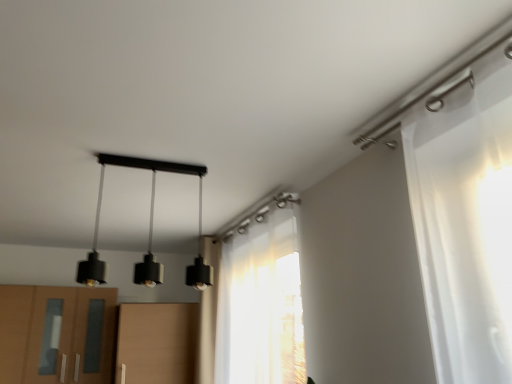
Question: Could you tell me if black matte pendant lights at center is facing translucent white curtain at center?

Choices:
 (A) yes
 (B) no

Answer: (B)

Question: Is black matte pendant lights at center wider than translucent white curtain at center?

Choices:
 (A) no
 (B) yes

Answer: (B)

Question: From a real-world perspective, does black matte pendant lights at center sit lower than translucent white curtain at center?

Choices:
 (A) yes
 (B) no

Answer: (B)

Question: Does black matte pendant lights at center have a lesser height compared to translucent white curtain at center?

Choices:
 (A) yes
 (B) no

Answer: (A)

Question: Is black matte pendant lights at center looking in the opposite direction of translucent white curtain at center?

Choices:
 (A) no
 (B) yes

Answer: (A)

Question: Does black matte pendant lights at center lie in front of translucent white curtain at center?

Choices:
 (A) no
 (B) yes

Answer: (B)

Question: From the image's perspective, is matte brown cabinet at lower left on translucent white curtain at center?

Choices:
 (A) no
 (B) yes

Answer: (A)

Question: Is matte brown cabinet at lower left facing towards translucent white curtain at center?

Choices:
 (A) no
 (B) yes

Answer: (A)

Question: From the image's perspective, is matte brown cabinet at lower left below translucent white curtain at center?

Choices:
 (A) yes
 (B) no

Answer: (A)

Question: Does matte brown cabinet at lower left have a lesser width compared to translucent white curtain at center?

Choices:
 (A) no
 (B) yes

Answer: (A)

Question: From a real-world perspective, is matte brown cabinet at lower left over translucent white curtain at center?

Choices:
 (A) yes
 (B) no

Answer: (B)

Question: Can you confirm if matte brown cabinet at lower left is taller than translucent white curtain at center?

Choices:
 (A) yes
 (B) no

Answer: (B)

Question: Is translucent white curtain at center positioned beyond the bounds of black matte pendant lights at center?

Choices:
 (A) yes
 (B) no

Answer: (A)